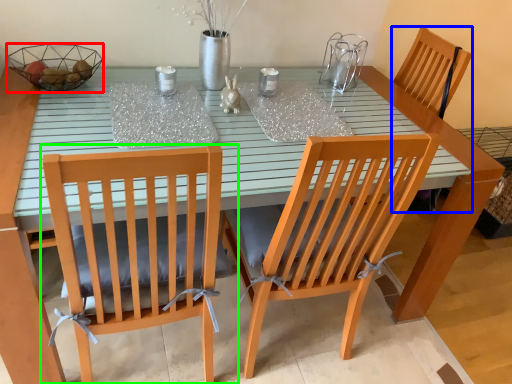
Question: Considering the real-world distances, which object is closest to glass bowl (highlighted by a red box)? armchair (highlighted by a blue box) or chair (highlighted by a green box).

Choices:
 (A) armchair
 (B) chair

Answer: (B)